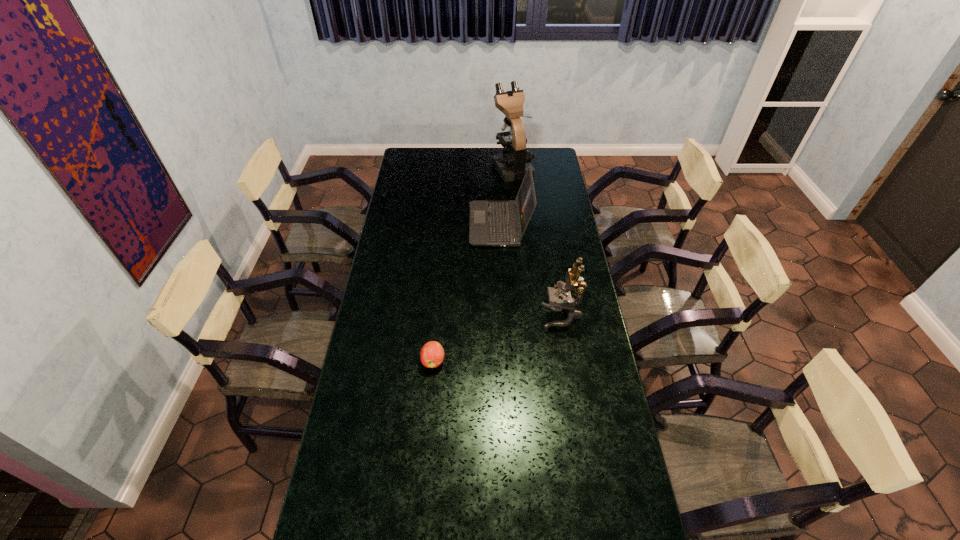
Find the location of a particular element. object that is the second closest to the nearest object is located at coordinates (492, 223).

Locate an element on the screen. This screenshot has width=960, height=540. object that is the nearest to the laptop_computer is located at coordinates 512,164.

Find the location of `vacant space that satisfies the following two spatial constraints: 1. on the screen of the second farthest object; 2. on the front side of the shortest object`. vacant space that satisfies the following two spatial constraints: 1. on the screen of the second farthest object; 2. on the front side of the shortest object is located at coordinates point(506,361).

The width and height of the screenshot is (960, 540). Identify the location of free space that satisfies the following two spatial constraints: 1. on the back side of the farthest object; 2. on the right side of the nearest object. (450, 166).

Image resolution: width=960 pixels, height=540 pixels. In order to click on free spot that satisfies the following two spatial constraints: 1. at the eyepieces of the shorter microscope; 2. on the front side of the apple in this screenshot , I will do `click(569, 361)`.